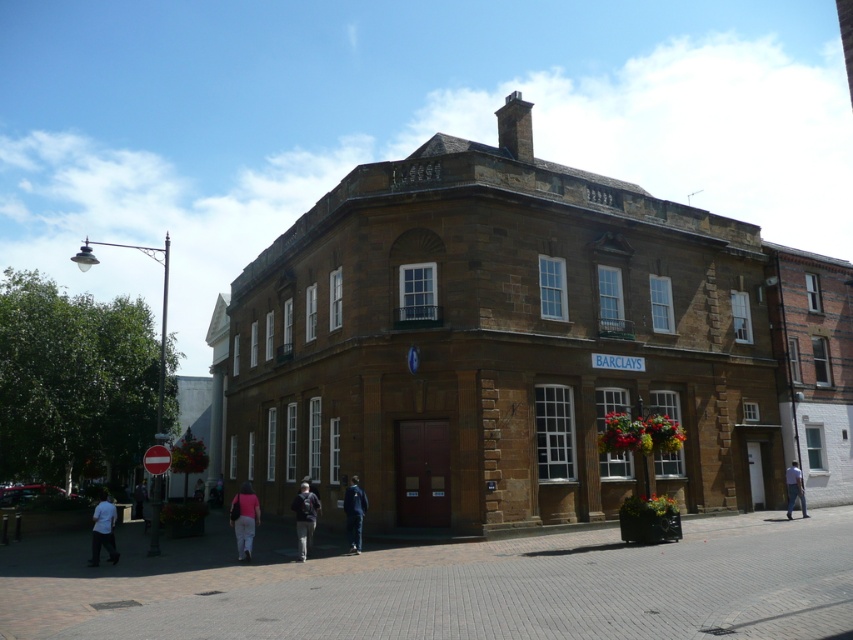
Question: Can you confirm if matte pink shirt at lower center is thinner than dark blue jacket at center?

Choices:
 (A) yes
 (B) no

Answer: (B)

Question: Which object is closer to the camera taking this photo?

Choices:
 (A) matte pink shirt at lower center
 (B) pink fabric at lower center

Answer: (A)

Question: Is the position of matte pink shirt at lower center more distant than that of dark blue jacket at center?

Choices:
 (A) yes
 (B) no

Answer: (B)

Question: Can you confirm if matte pink shirt at lower center is positioned below dark blue jacket at center?

Choices:
 (A) yes
 (B) no

Answer: (A)

Question: Which object is closer to the camera taking this photo?

Choices:
 (A) denim pants at lower right
 (B) pink fabric at lower center
 (C) white fabric at lower left

Answer: (C)

Question: Estimate the real-world distances between objects in this image. Which object is farther from the white fabric at lower left?

Choices:
 (A) pink fabric at lower center
 (B) dark blue jacket at center
 (C) denim pants at lower right
 (D) dark gray jacket at center

Answer: (C)